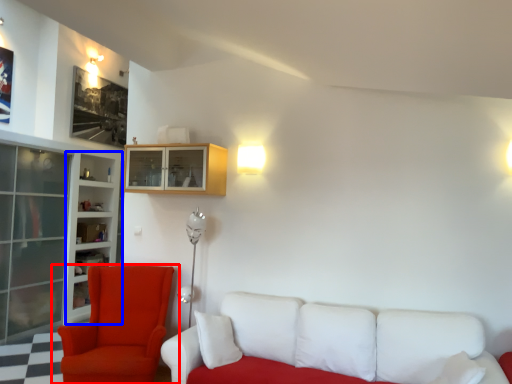
Question: Which of the following is the closest to the observer, chair (highlighted by a red box) or bookshelf (highlighted by a blue box)?

Choices:
 (A) chair
 (B) bookshelf

Answer: (A)